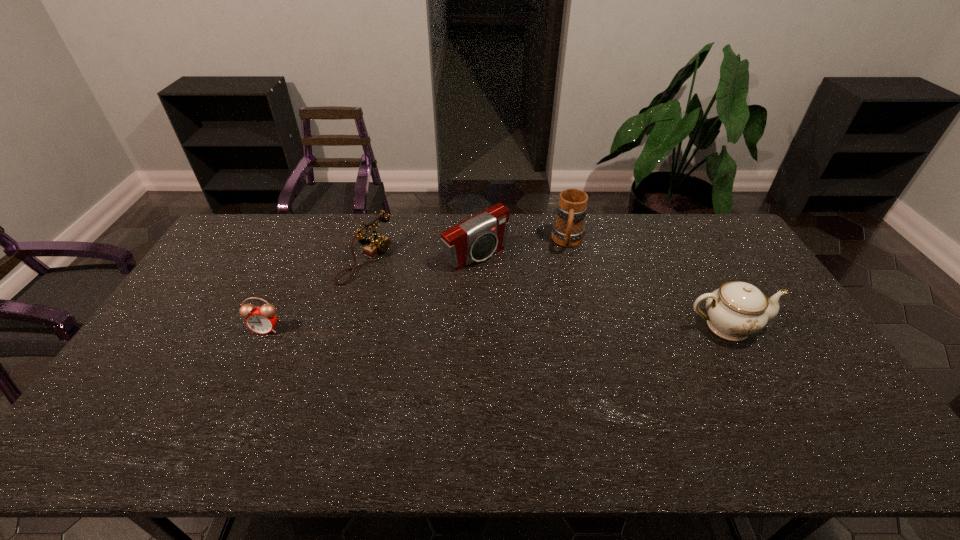
The width and height of the screenshot is (960, 540). I want to click on alarm clock, so click(261, 320).

Image resolution: width=960 pixels, height=540 pixels. Identify the location of chinaware. (736, 310).

Where is `camera`? Image resolution: width=960 pixels, height=540 pixels. camera is located at coordinates (475, 239).

Where is `the fourth object from right to left`? the fourth object from right to left is located at coordinates (377, 244).

Where is `the fourth object from left to right`? This screenshot has width=960, height=540. the fourth object from left to right is located at coordinates (568, 230).

Image resolution: width=960 pixels, height=540 pixels. I want to click on free space located 0.080m on the clock face of the alarm clock, so click(252, 357).

Where is `free space located 0.080m at the spout of the rightmost object`? This screenshot has height=540, width=960. free space located 0.080m at the spout of the rightmost object is located at coordinates (794, 326).

The height and width of the screenshot is (540, 960). I want to click on vacant region located 0.280m on the front-facing side of the camera, so click(x=552, y=321).

This screenshot has height=540, width=960. What are the coordinates of `free space located 0.370m on the front-facing side of the camera` in the screenshot? It's located at (573, 340).

Locate an element on the screen. The width and height of the screenshot is (960, 540). blank area located 0.290m on the front-facing side of the camera is located at coordinates 554,323.